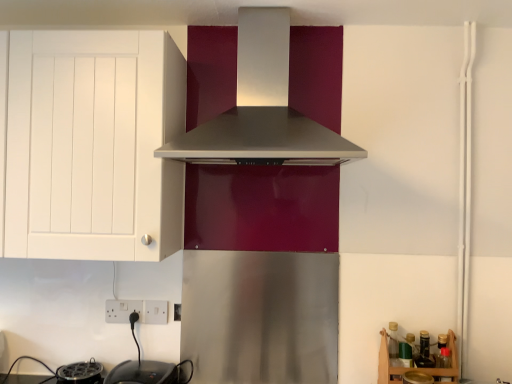
Question: Should I look upward or downward to see black glossy electric kettle at lower left, placed as the 2th appliance when sorted from left to right?

Choices:
 (A) down
 (B) up

Answer: (A)

Question: Can you confirm if satin silver range hood at center is taller than wooden at lower right?

Choices:
 (A) no
 (B) yes

Answer: (B)

Question: From the image's perspective, is satin silver range hood at center over wooden at lower right?

Choices:
 (A) no
 (B) yes

Answer: (B)

Question: Is satin silver range hood at center closer to camera compared to wooden at lower right?

Choices:
 (A) yes
 (B) no

Answer: (A)

Question: Is satin silver range hood at center not within wooden at lower right?

Choices:
 (A) no
 (B) yes

Answer: (B)

Question: Does satin silver range hood at center have a lesser width compared to wooden at lower right?

Choices:
 (A) yes
 (B) no

Answer: (B)

Question: Is satin silver range hood at center surrounding wooden at lower right?

Choices:
 (A) no
 (B) yes

Answer: (A)

Question: Considering the relative positions of black plastic toaster at lower left, arranged as the 1th appliance when viewed from the left, and black glossy electric kettle at lower left, placed as the 2th appliance when sorted from left to right, in the image provided, is black plastic toaster at lower left, arranged as the 1th appliance when viewed from the left, to the right of black glossy electric kettle at lower left, placed as the 2th appliance when sorted from left to right, from the viewer's perspective?

Choices:
 (A) no
 (B) yes

Answer: (A)

Question: Is black plastic toaster at lower left, arranged as the 1th appliance when viewed from the left, to the left of black glossy electric kettle at lower left, placed as the 2th appliance when sorted from left to right, from the viewer's perspective?

Choices:
 (A) no
 (B) yes

Answer: (B)

Question: Is black plastic toaster at lower left, positioned as the second appliance in right-to-left order, positioned behind black glossy electric kettle at lower left, placed as the 2th appliance when sorted from left to right?

Choices:
 (A) yes
 (B) no

Answer: (A)

Question: Is black plastic toaster at lower left, arranged as the 1th appliance when viewed from the left, not within black glossy electric kettle at lower left, which is counted as the 1th appliance, starting from the right?

Choices:
 (A) no
 (B) yes

Answer: (B)

Question: From a real-world perspective, is black plastic toaster at lower left, arranged as the 1th appliance when viewed from the left, beneath black glossy electric kettle at lower left, placed as the 2th appliance when sorted from left to right?

Choices:
 (A) no
 (B) yes

Answer: (B)

Question: Is black glossy electric kettle at lower left, which is counted as the 1th appliance, starting from the right, completely or partially inside black plastic toaster at lower left, arranged as the 1th appliance when viewed from the left?

Choices:
 (A) no
 (B) yes

Answer: (A)

Question: Does white matte cabinet at left have a smaller size compared to black plastic toaster at lower left, arranged as the 1th appliance when viewed from the left?

Choices:
 (A) yes
 (B) no

Answer: (B)